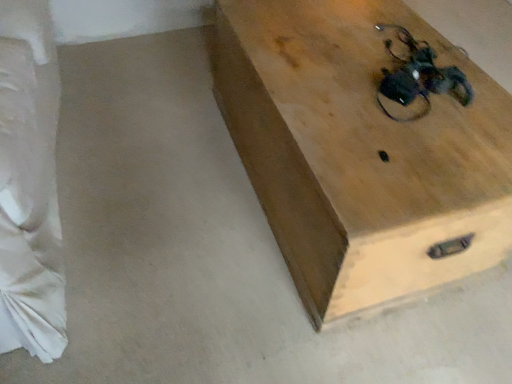
Locate an element on the screen. free spot in front of natural wood chest at upper right is located at coordinates (297, 317).